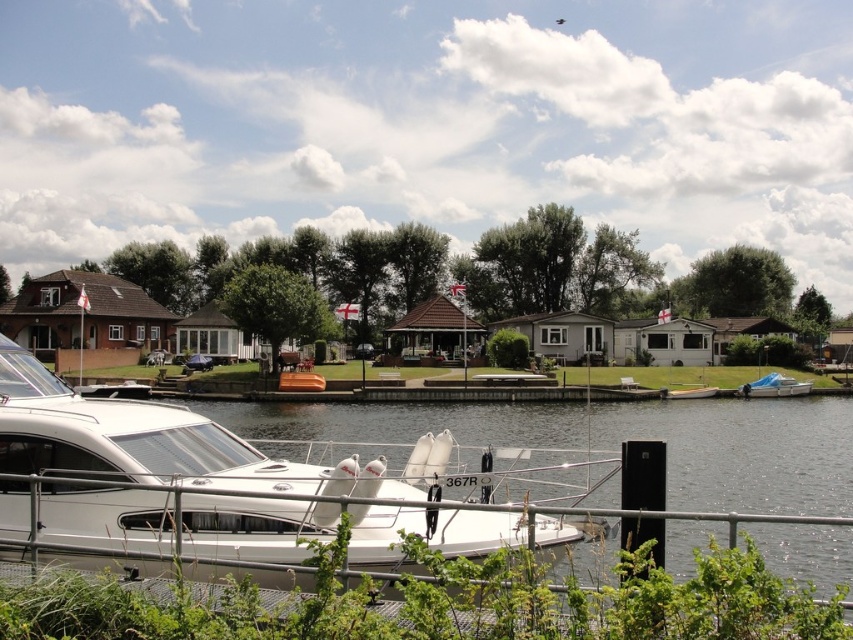
You are standing at the lakeside and want to board the boat that is closer to the center of the image. Which boat should you choose between the white glossy boat at center and the white plastic boat at lower right?

You should choose the white glossy boat at center because it is positioned closer to the center of the image compared to the white plastic boat at lower right.

You are a photographer positioned at the lakeside and want to capture both the white glossy boat at center and the white fiberglass dinghy at center in your shot. Based on their positions, which one appears closer to you?

The white glossy boat at center appears closer because it is positioned in front of the white fiberglass dinghy at center.

You are a boat inspector who needs to check both the white plastic boat at lower right and the brown wooden boat at center. Given that your inspection equipment has a maximum range of 40 meters, can you inspect both boats without moving your position?

The white plastic boat at lower right and the brown wooden boat at center are 38.88 meters apart. Since the distance between them is within the 40 meters range of your equipment, you can inspect both boats without moving your position.